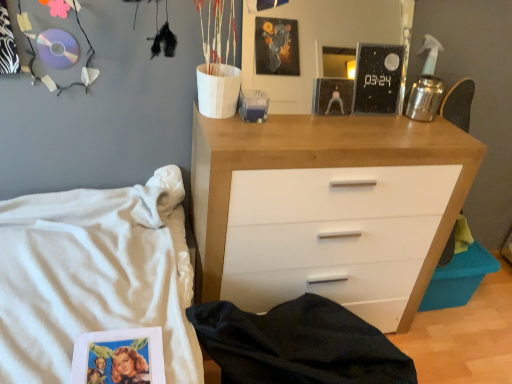
Question: Can you confirm if white cotton bed at lower left is shorter than black glossy clock at upper center?

Choices:
 (A) no
 (B) yes

Answer: (A)

Question: Does white cotton bed at lower left have a larger size compared to black glossy clock at upper center?

Choices:
 (A) no
 (B) yes

Answer: (B)

Question: Is white cotton bed at lower left not inside black glossy clock at upper center?

Choices:
 (A) no
 (B) yes

Answer: (B)

Question: Is the depth of white cotton bed at lower left greater than that of black glossy clock at upper center?

Choices:
 (A) no
 (B) yes

Answer: (A)

Question: Is black glossy clock at upper center surrounded by white cotton bed at lower left?

Choices:
 (A) yes
 (B) no

Answer: (B)

Question: Considering their positions, is white cotton bed at lower left located in front of or behind white wood chest of drawers at center?

Choices:
 (A) behind
 (B) front

Answer: (B)

Question: From a real-world perspective, relative to white wood chest of drawers at center, is white cotton bed at lower left vertically above or below?

Choices:
 (A) below
 (B) above

Answer: (A)

Question: From the image's perspective, is white cotton bed at lower left above or below white wood chest of drawers at center?

Choices:
 (A) above
 (B) below

Answer: (B)

Question: In the image, is white cotton bed at lower left on the left side or the right side of white wood chest of drawers at center?

Choices:
 (A) left
 (B) right

Answer: (A)

Question: From the image's perspective, is white cotton bed at lower left above or below black glossy clock at upper center?

Choices:
 (A) above
 (B) below

Answer: (B)

Question: Would you say white cotton bed at lower left is to the left or to the right of black glossy clock at upper center in the picture?

Choices:
 (A) left
 (B) right

Answer: (A)

Question: Is white cotton bed at lower left wider or thinner than black glossy clock at upper center?

Choices:
 (A) thin
 (B) wide

Answer: (B)

Question: Is white cotton bed at lower left bigger or smaller than black glossy clock at upper center?

Choices:
 (A) big
 (B) small

Answer: (A)

Question: Would you say white wood chest of drawers at center is to the left or to the right of white cotton bed at lower left in the picture?

Choices:
 (A) right
 (B) left

Answer: (A)

Question: Considering the positions of white wood chest of drawers at center and white cotton bed at lower left in the image, is white wood chest of drawers at center bigger or smaller than white cotton bed at lower left?

Choices:
 (A) big
 (B) small

Answer: (B)